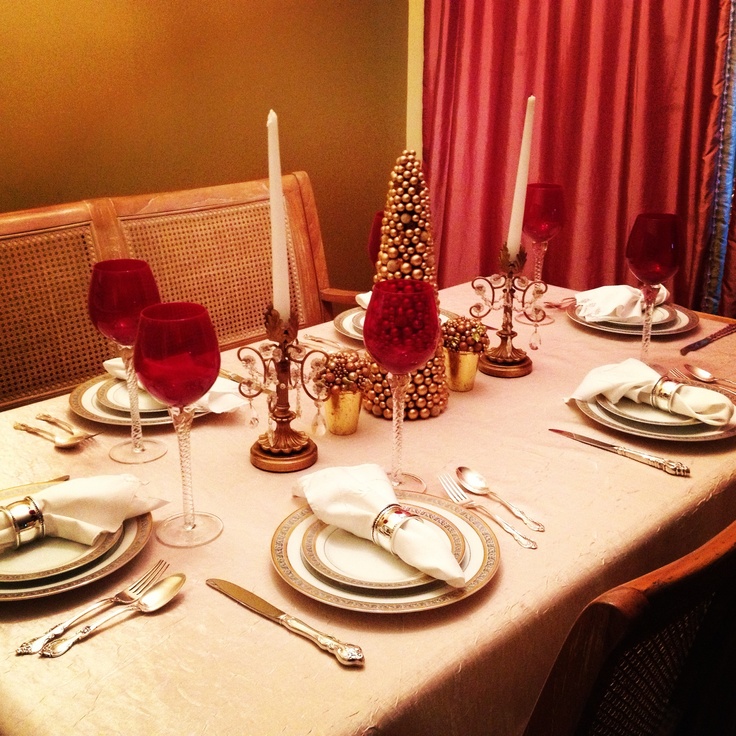
Locate an element on the screen. plates is located at coordinates (59, 590), (372, 601), (648, 442), (681, 330), (347, 335), (98, 416).